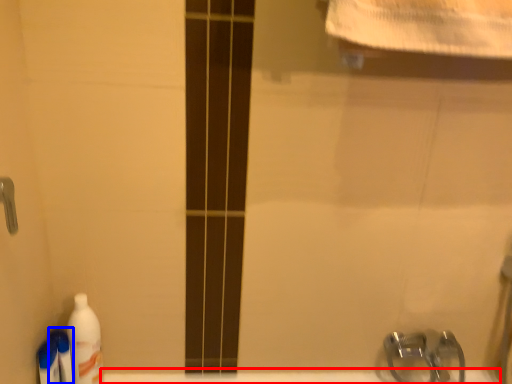
Question: Which of the following is the closest to the observer, bath (highlighted by a red box) or cleaning product (highlighted by a blue box)?

Choices:
 (A) bath
 (B) cleaning product

Answer: (B)